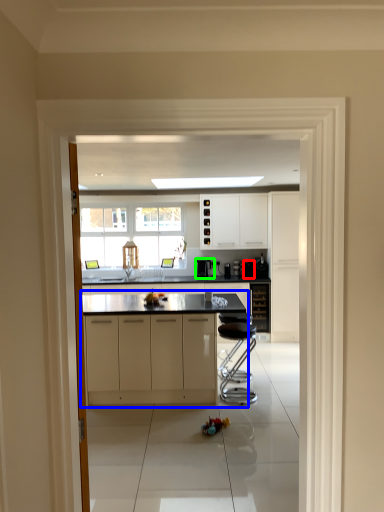
Question: Based on their relative distances, which object is farther from appliance (highlighted by a red box)? Choose from cabinetry (highlighted by a blue box) and appliance (highlighted by a green box).

Choices:
 (A) cabinetry
 (B) appliance

Answer: (A)